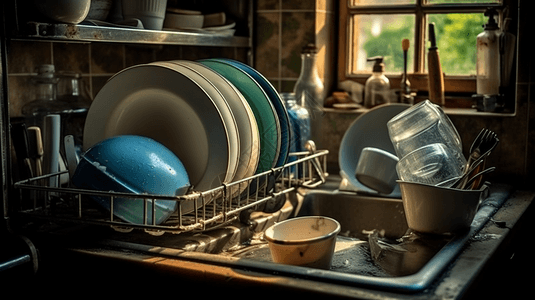
This screenshot has height=300, width=535. Find the location of `bowl`. bowl is located at coordinates coord(145,155), coord(305,239), coord(447,197), coord(376,163), coord(155,15), coord(61,6), coord(197,13).